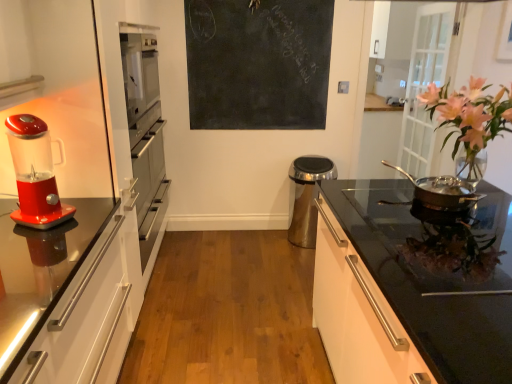
Question: Considering their positions, is pink glass vase at right located in front of or behind shiny plastic blender at left?

Choices:
 (A) front
 (B) behind

Answer: (B)

Question: From a real-world perspective, is pink glass vase at right positioned above or below shiny plastic blender at left?

Choices:
 (A) below
 (B) above

Answer: (B)

Question: Estimate the real-world distances between objects in this image. Which object is farther from the black chalkboard at upper center?

Choices:
 (A) satin silver trash can at center
 (B) pink glass vase at right
 (C) shiny plastic blender at left
 (D) black glossy cabinet at right
 (E) shiny silver pan at right

Answer: (C)

Question: Which is farther from the black chalkboard at upper center?

Choices:
 (A) shiny plastic blender at left
 (B) satin silver trash can at center
 (C) black glossy cabinet at right
 (D) shiny silver pan at right
 (E) pink glass vase at right

Answer: (A)